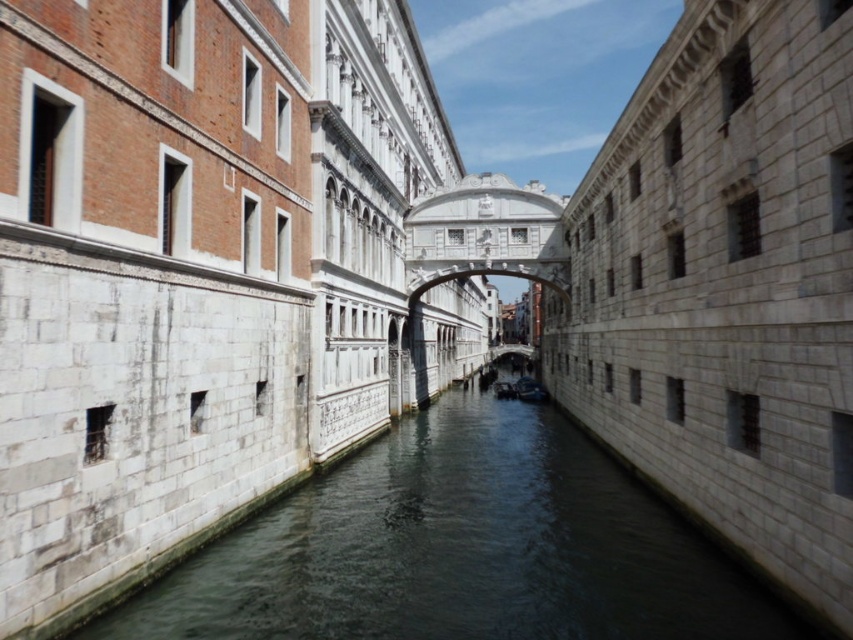
Question: Which point is farther to the camera?

Choices:
 (A) dark gray stone water at center
 (B) dark blue fabric boat at center

Answer: (B)

Question: Does dark gray stone water at center appear over dark blue fabric boat at center?

Choices:
 (A) yes
 (B) no

Answer: (B)

Question: Does dark gray stone water at center have a smaller size compared to dark blue fabric boat at center?

Choices:
 (A) yes
 (B) no

Answer: (B)

Question: Can you confirm if dark gray stone water at center is positioned below dark blue fabric boat at center?

Choices:
 (A) yes
 (B) no

Answer: (A)